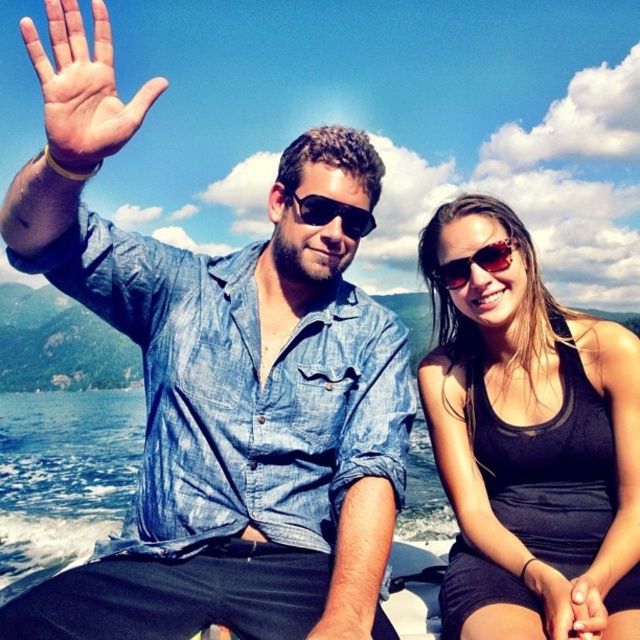
Question: Can you confirm if matte skin hand at lower right is positioned to the left of black plastic sunglasses at center?

Choices:
 (A) no
 (B) yes

Answer: (A)

Question: Can you confirm if matte skin hand at lower right is positioned below matte skin hand at center?

Choices:
 (A) yes
 (B) no

Answer: (B)

Question: Which point is farther to the camera?

Choices:
 (A) black matte tank top at right
 (B) sunglasses at center
 (C) denim shirt at left
 (D) matte skin palm at upper left

Answer: (B)

Question: Which object appears farthest from the camera in this image?

Choices:
 (A) denim shirt at left
 (B) sunglasses at center
 (C) black matte tank top at right

Answer: (B)

Question: Among these points, which one is farthest from the camera?

Choices:
 (A) (273, 336)
 (B) (497, 244)

Answer: (B)

Question: Is black matte tank top at right below matte skin hand at lower right?

Choices:
 (A) yes
 (B) no

Answer: (B)